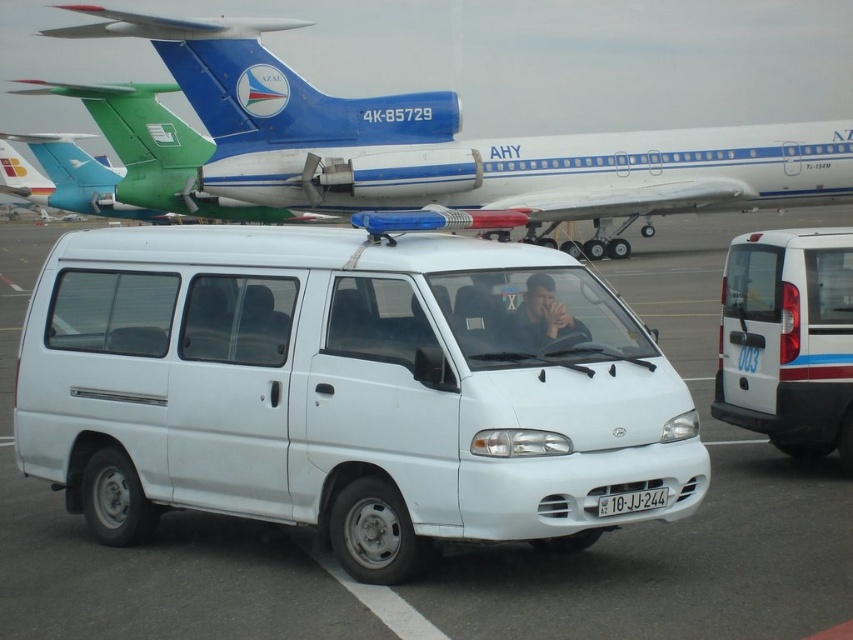
Question: Is matte black shirt at center positioned in front of white plastic license plate at center?

Choices:
 (A) yes
 (B) no

Answer: (B)

Question: Which is farther from the white matte van at center?

Choices:
 (A) white matte van at right
 (B) white plastic license plate at center
 (C) blue metallic airplane at center
 (D) matte black shirt at center

Answer: (C)

Question: Is blue metallic airplane at center to the right of matte black shirt at center from the viewer's perspective?

Choices:
 (A) yes
 (B) no

Answer: (B)

Question: Is blue metallic airplane at center wider than white matte van at right?

Choices:
 (A) no
 (B) yes

Answer: (B)

Question: Which point is farther from the camera taking this photo?

Choices:
 (A) (483, 392)
 (B) (846, 348)
 (C) (242, 58)

Answer: (C)

Question: Which is farther from the white matte van at right?

Choices:
 (A) matte black shirt at center
 (B) white plastic license plate at center

Answer: (B)